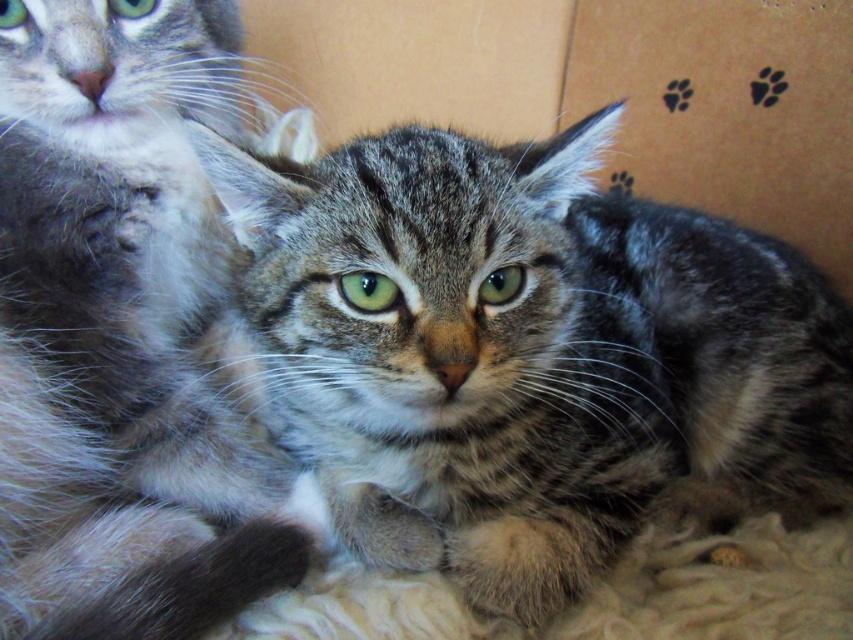
You are a photographer aiming to capture a closeup of the soft gray fur cat at upper left. The camera focus point is currently set at coordinates point (117, 330). Will this point be on the soft gray fur cat at upper left?

Yes, the point (117, 330) is on the soft gray fur cat at upper left, so the focus point is correctly placed.

You are a photographer trying to capture both cats in a single shot. Since the tabby fur cat at center is blocking the view of the soft gray fur cat at upper left, can you move the camera slightly to the left to include both cats in the frame?

The tabby fur cat at center is to the right of the soft gray fur cat at upper left, so moving the camera slightly to the left may allow you to include both cats in the frame by shifting the perspective to capture the soft gray fur cat at upper left more prominently while still including the tabby fur cat at center.

You are a cat owner who wants to ensure your cats are safe inside the cardboard box. Based on the image, is the cardboard at center covering the tabby fur cat at center?

The tabby fur cat at center is below cardboard at center, so the cardboard at center is covering it.